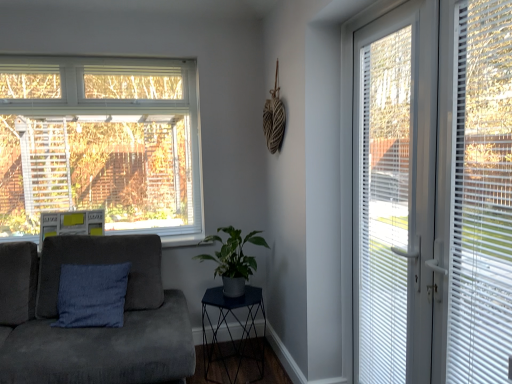
Question: Can you confirm if blue fabric cushion at left is shorter than metallic dark blue side table at center?

Choices:
 (A) yes
 (B) no

Answer: (B)

Question: Is blue fabric cushion at left placed right next to metallic dark blue side table at center?

Choices:
 (A) no
 (B) yes

Answer: (A)

Question: Is blue fabric cushion at left oriented away from metallic dark blue side table at center?

Choices:
 (A) no
 (B) yes

Answer: (A)

Question: From a real-world perspective, is blue fabric cushion at left on top of metallic dark blue side table at center?

Choices:
 (A) no
 (B) yes

Answer: (B)

Question: Is blue fabric cushion at left aimed at metallic dark blue side table at center?

Choices:
 (A) yes
 (B) no

Answer: (B)

Question: Relative to suede couch at left, is white plastic door at right in front or behind?

Choices:
 (A) front
 (B) behind

Answer: (A)

Question: In terms of width, does white plastic door at right look wider or thinner when compared to suede couch at left?

Choices:
 (A) wide
 (B) thin

Answer: (B)

Question: From the image's perspective, is white plastic door at right positioned above or below suede couch at left?

Choices:
 (A) below
 (B) above

Answer: (B)

Question: Does point (507, 173) appear closer or farther from the camera than point (29, 304)?

Choices:
 (A) closer
 (B) farther

Answer: (A)

Question: Considering the positions of blue fabric cushion at left and suede couch at left in the image, is blue fabric cushion at left wider or thinner than suede couch at left?

Choices:
 (A) thin
 (B) wide

Answer: (A)

Question: Relative to suede couch at left, is blue fabric cushion at left in front or behind?

Choices:
 (A) front
 (B) behind

Answer: (B)

Question: Based on their sizes in the image, would you say blue fabric cushion at left is bigger or smaller than suede couch at left?

Choices:
 (A) big
 (B) small

Answer: (B)

Question: Considering the relative positions of blue fabric cushion at left and suede couch at left in the image provided, is blue fabric cushion at left to the left or to the right of suede couch at left?

Choices:
 (A) right
 (B) left

Answer: (A)

Question: From a real-world perspective, is suede couch at left above or below white plastic blinds at right?

Choices:
 (A) above
 (B) below

Answer: (B)

Question: Does point (187, 321) appear closer or farther from the camera than point (400, 114)?

Choices:
 (A) farther
 (B) closer

Answer: (A)